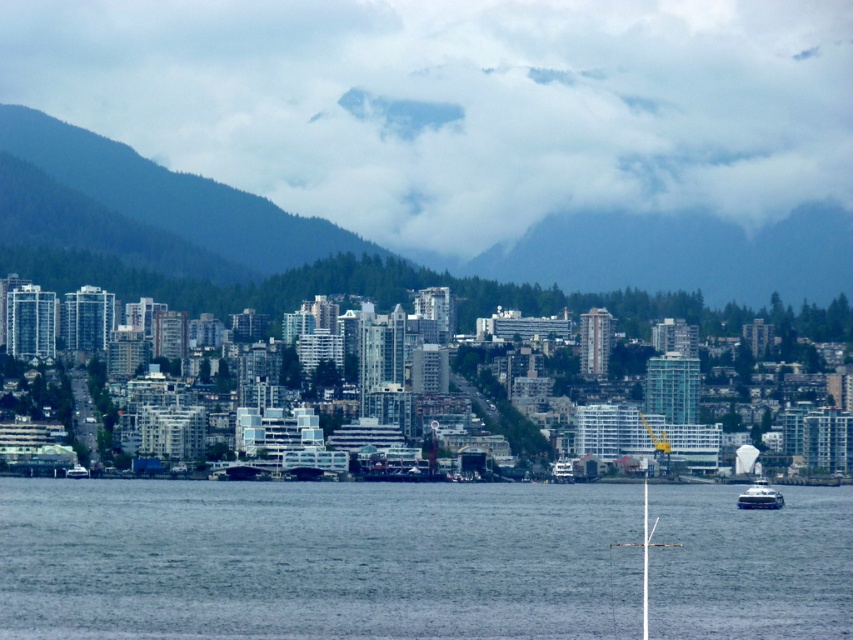
You are a drone operator planning to fly a drone from the point at coordinates point (212, 182) to point (776, 508). Considering the cityscape described, will the drone have an unobstructed path between these two points?

Point point (212, 182) is in front of point point (776, 508), so the drone might face obstructions from the high rise buildings between them. Check the flight path for any potential obstacles before proceeding.

You are a photographer standing on a cliff overlooking the coastal city. You notice two points in your viewfinder labeled as point (399,218) and point (225,483). Which point is nearer to your current position?

Point (399,218) is closer to the camera than point (225,483), so the photographer should focus on point (399,218) for a closer shot.

You are a photographer trying to capture the blue water at lower center in your shot. However, you notice the cloudy fog at upper center might interfere with your view. Can you adjust your position to the right to avoid the fog?

The cloudy fog at upper center is to the left of the blue water at lower center, so moving your position to the right would help avoid the fog and keep the blue water at lower center in focus.